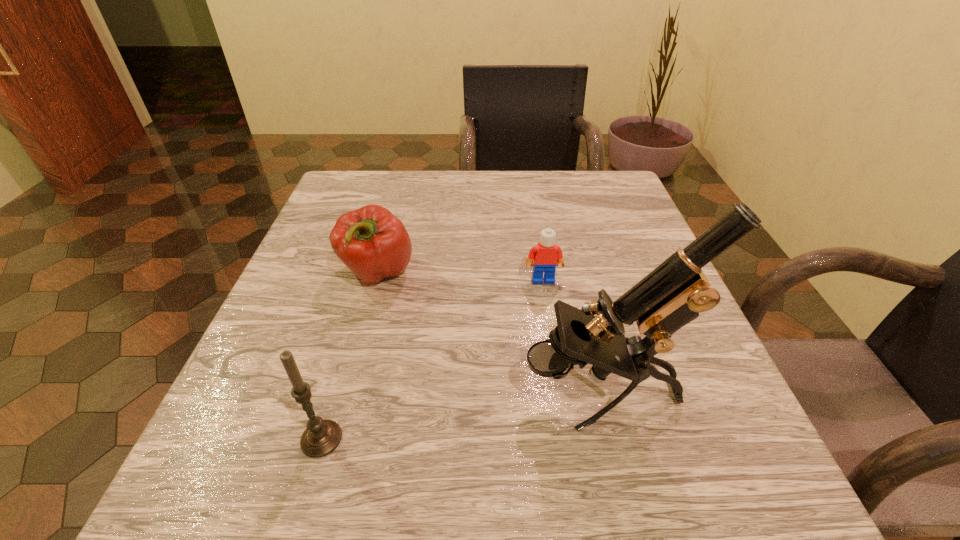
The height and width of the screenshot is (540, 960). In the image, there is a desktop. What are the coordinates of `vacant space at the far right corner` in the screenshot? It's located at (590, 173).

Where is `vacant region at the near right corner of the desktop`? The height and width of the screenshot is (540, 960). vacant region at the near right corner of the desktop is located at coordinates (681, 461).

I want to click on vacant space that is in between the shortest object and the candle, so click(x=432, y=359).

Find the location of a particular element. free area in between the second shortest object and the third shortest object is located at coordinates (349, 356).

Identify the location of free spot between the second tallest object and the microscope. This screenshot has width=960, height=540. (461, 416).

The image size is (960, 540). Find the location of `vacant area between the third shortest object and the tallest object`. vacant area between the third shortest object and the tallest object is located at coordinates (461, 416).

At what (x,y) coordinates should I click in order to perform the action: click on blank region between the Lego and the bell pepper. Please return your answer as a coordinate pair (x, y). The height and width of the screenshot is (540, 960). Looking at the image, I should click on (460, 276).

The image size is (960, 540). Find the location of `vacant space that is in between the candle and the second shortest object`. vacant space that is in between the candle and the second shortest object is located at coordinates (349, 356).

Identify the location of free space between the tallest object and the bell pepper. (489, 333).

Select which object is the second closest to the candle. Please provide its 2D coordinates. Your answer should be formatted as a tuple, i.e. [(x, y)], where the tuple contains the x and y coordinates of a point satisfying the conditions above.

[(672, 295)]